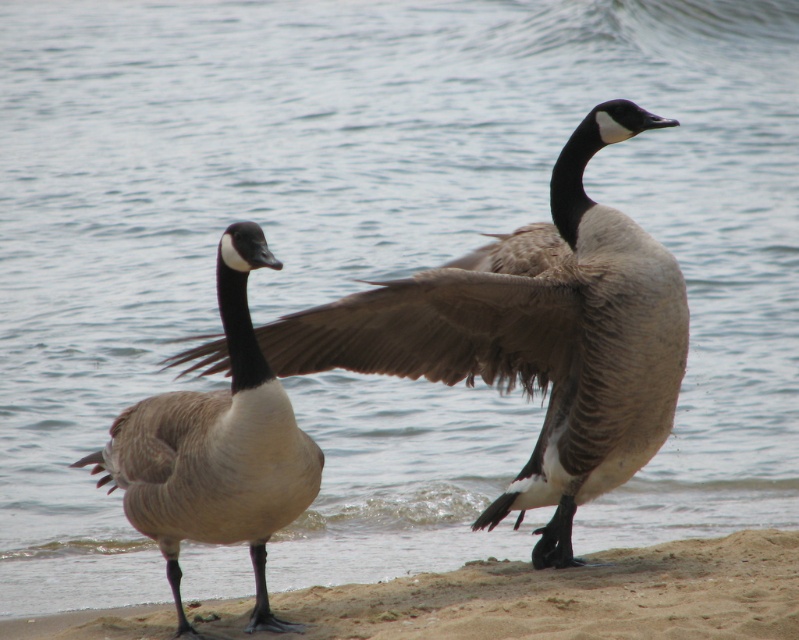
You are standing at the origin point of the image coordinate system. You see a brown feathered goose at center at point (533, 336). If you walk 0.1 units to the right, will you be closer to the goose?

The point (533, 336) is where the brown feathered goose at center is located. Walking 0.1 units to the right would move you to 0.625, 0.668, which is further away from the goose. Therefore, you will not be closer.

You are a photographer trying to capture both the sandy brown at lower center and the matte brown duck at left in a single frame. Which object should you focus on first to ensure both are in the frame?

The sandy brown at lower center is shorter than the matte brown duck at left, so you should focus on the matte brown duck at left first to ensure both are in the frame.